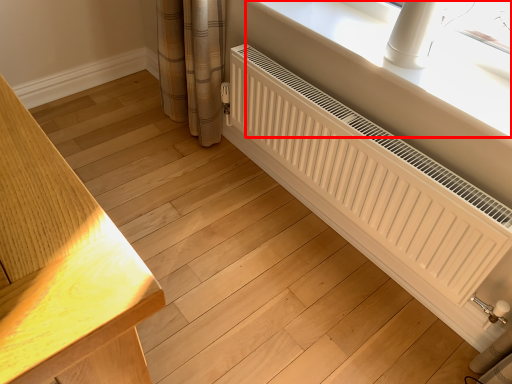
Question: From the image's perspective, where is window sill (annotated by the red box) located in relation to radiator in the image?

Choices:
 (A) above
 (B) below

Answer: (A)